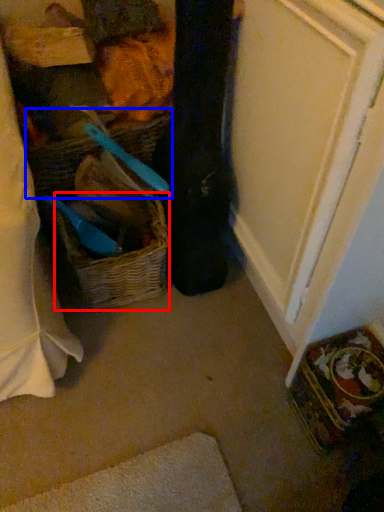
Question: Among these objects, which one is nearest to the camera, picnic basket (highlighted by a red box) or basket (highlighted by a blue box)?

Choices:
 (A) picnic basket
 (B) basket

Answer: (B)